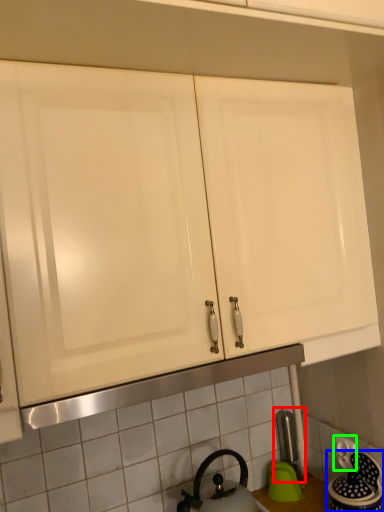
Question: Based on their relative distances, which object is nearer to faucet (highlighted by a red box)? Choose from appliance (highlighted by a blue box) and electric outlet (highlighted by a green box).

Choices:
 (A) appliance
 (B) electric outlet

Answer: (B)